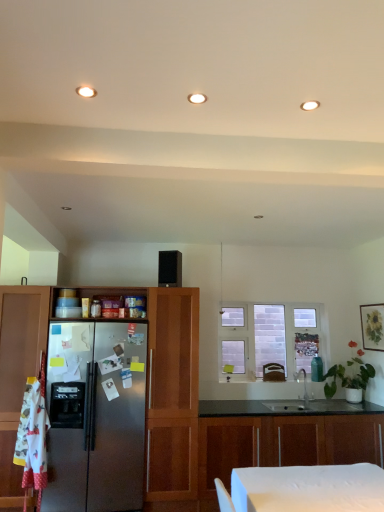
Identify the location of free location to the right of satin nickel faucet at center. The image size is (384, 512). (324, 406).